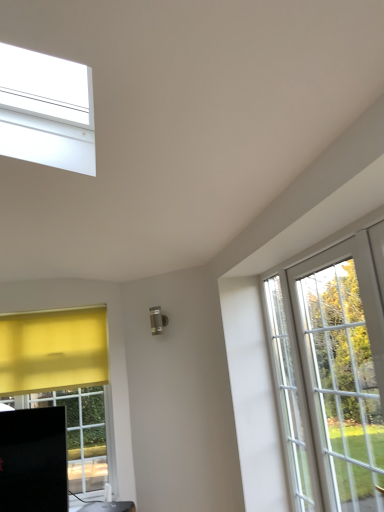
Question: Does matte black router at lower left come behind white glass screen door at right?

Choices:
 (A) no
 (B) yes

Answer: (B)

Question: Is matte black router at lower left wider than white glass screen door at right?

Choices:
 (A) yes
 (B) no

Answer: (A)

Question: From the image's perspective, would you say matte black router at lower left is shown under white glass screen door at right?

Choices:
 (A) no
 (B) yes

Answer: (B)

Question: From the image's perspective, is matte black router at lower left located above white glass screen door at right?

Choices:
 (A) no
 (B) yes

Answer: (A)

Question: Is matte black router at lower left positioned before white glass screen door at right?

Choices:
 (A) yes
 (B) no

Answer: (B)

Question: Does matte black router at lower left have a greater height compared to white glass screen door at right?

Choices:
 (A) no
 (B) yes

Answer: (A)

Question: From a real-world perspective, does white glass screen door at right stand above matte black router at lower left?

Choices:
 (A) no
 (B) yes

Answer: (B)

Question: From a real-world perspective, is white glass screen door at right below matte black router at lower left?

Choices:
 (A) yes
 (B) no

Answer: (B)

Question: Is white glass screen door at right not within matte black router at lower left?

Choices:
 (A) yes
 (B) no

Answer: (A)

Question: Is the depth of white glass screen door at right greater than that of matte black router at lower left?

Choices:
 (A) no
 (B) yes

Answer: (A)

Question: Can you confirm if white glass screen door at right is positioned to the right of matte black router at lower left?

Choices:
 (A) no
 (B) yes

Answer: (B)

Question: Is white glass screen door at right positioned with its back to matte black router at lower left?

Choices:
 (A) yes
 (B) no

Answer: (B)

Question: Is white glass screen door at right bigger or smaller than matte black router at lower left?

Choices:
 (A) big
 (B) small

Answer: (A)